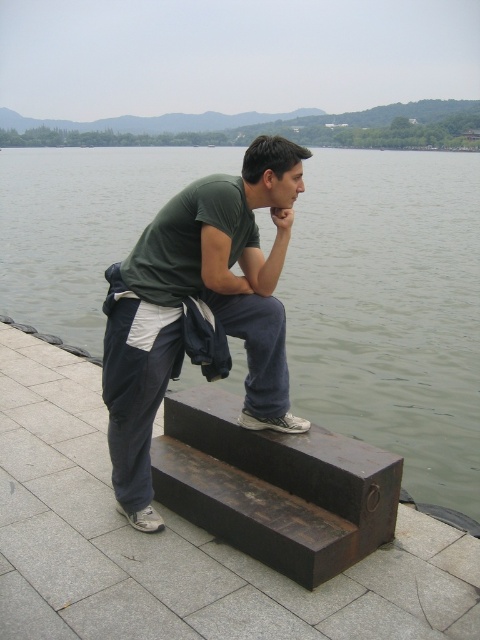
Question: Can you confirm if green water at upper center is bigger than dark brown wood at center?

Choices:
 (A) yes
 (B) no

Answer: (A)

Question: Among these objects, which one is farthest from the camera?

Choices:
 (A) matte green t-shirt at center
 (B) dark brown wood at center
 (C) dark brown wood at lower center

Answer: (A)

Question: Which object is the closest to the matte green t-shirt at center?

Choices:
 (A) dark brown wood at center
 (B) green water at upper center

Answer: (A)

Question: Is dark brown wood at lower center to the right of dark brown wood at center from the viewer's perspective?

Choices:
 (A) yes
 (B) no

Answer: (B)

Question: Which object is closer to the camera taking this photo?

Choices:
 (A) green water at upper center
 (B) matte green t-shirt at center
 (C) dark brown wood at center

Answer: (C)

Question: Can you confirm if green water at upper center is wider than matte green t-shirt at center?

Choices:
 (A) yes
 (B) no

Answer: (A)